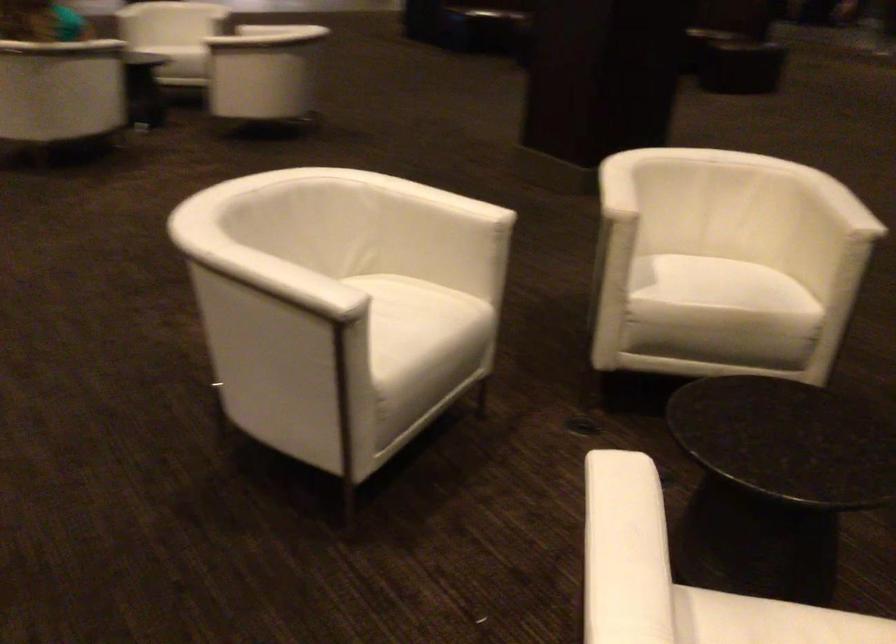
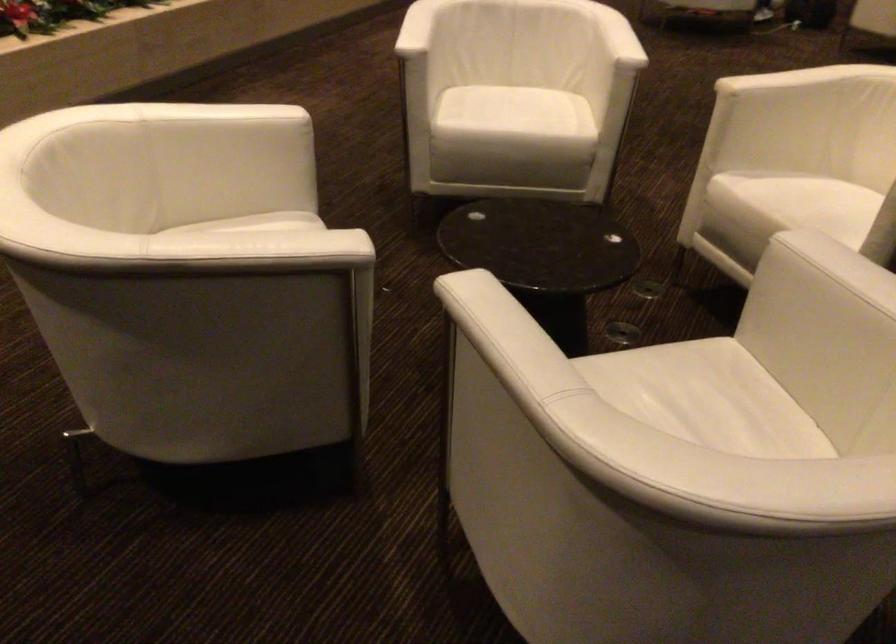
Locate, in the second image, the point that corresponds to (x=718, y=283) in the first image.

(794, 198)